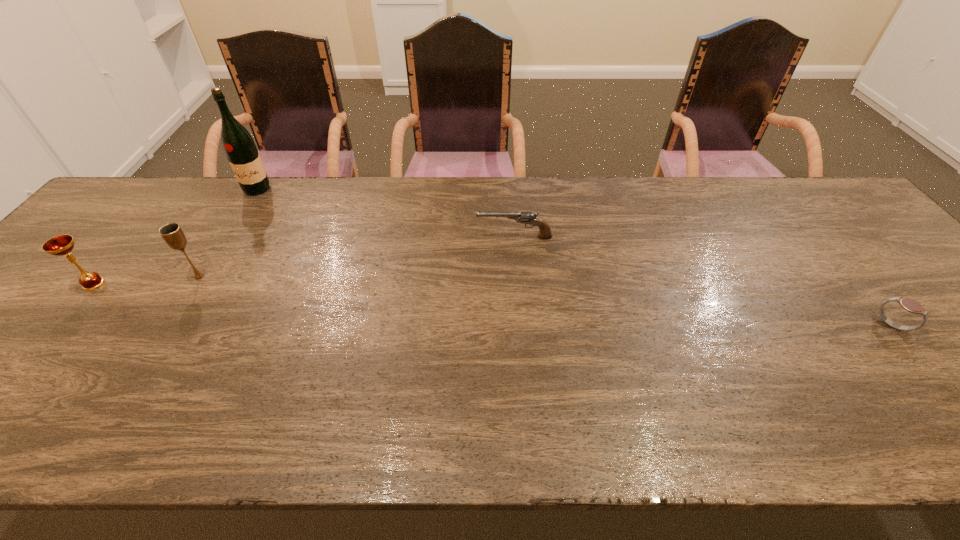
Find the location of a particular element. liquor is located at coordinates (239, 147).

You are a GUI agent. You are given a task and a screenshot of the screen. Output one action in this format:
    pyautogui.click(x=<x>, y=<y>)
    Task: Click on the tallest object
    
    Given the screenshot: What is the action you would take?
    pyautogui.click(x=239, y=147)

Find the location of a particular element. Image resolution: width=960 pixels, height=540 pixels. the right chalice is located at coordinates (172, 233).

The image size is (960, 540). In order to click on the left chalice in this screenshot , I will do `click(60, 245)`.

The image size is (960, 540). Identify the location of the leftmost object. (60, 245).

At what (x,y) coordinates should I click in order to perform the action: click on gun. Please return your answer as a coordinate pair (x, y). Looking at the image, I should click on (545, 233).

You are a GUI agent. You are given a task and a screenshot of the screen. Output one action in this format:
    pyautogui.click(x=<x>, y=<y>)
    Task: Click on the second object from right to left
    
    Given the screenshot: What is the action you would take?
    pyautogui.click(x=545, y=233)

The height and width of the screenshot is (540, 960). Identify the location of the shortest object. (910, 305).

This screenshot has width=960, height=540. I want to click on watch, so click(910, 305).

In order to click on vacant area situated on the front-facing side of the farthest object in this screenshot , I will do `click(213, 261)`.